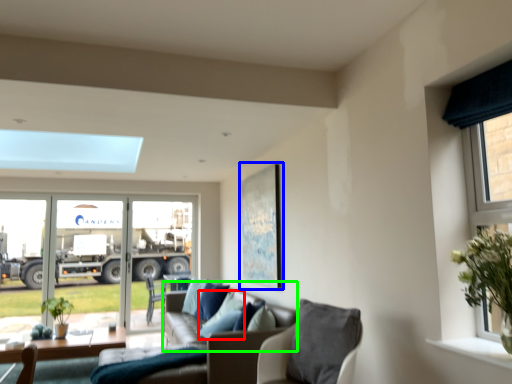
Question: Which object is positioned closest to pillow (highlighted by a red box)? Select from picture frame (highlighted by a blue box) and couch (highlighted by a green box).

Choices:
 (A) picture frame
 (B) couch

Answer: (B)